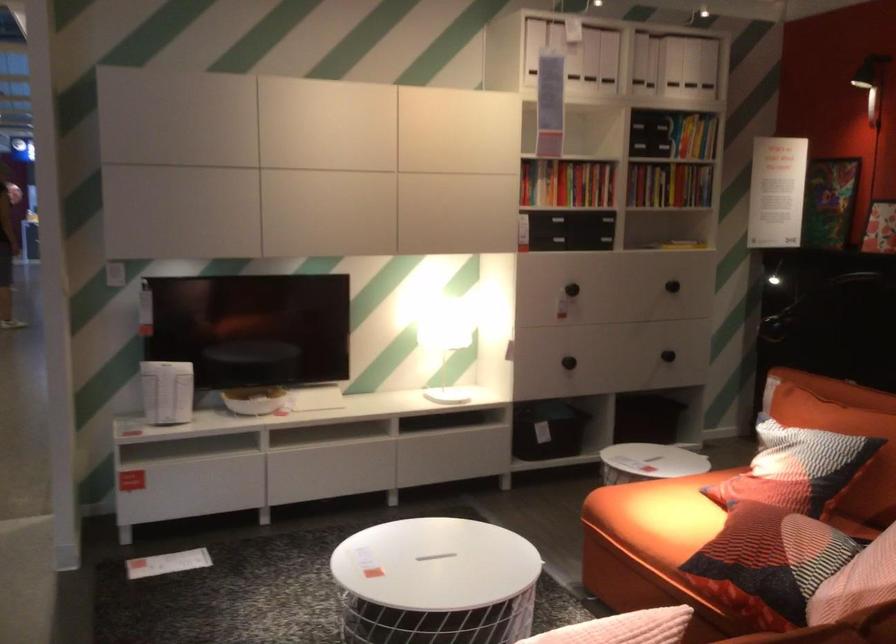
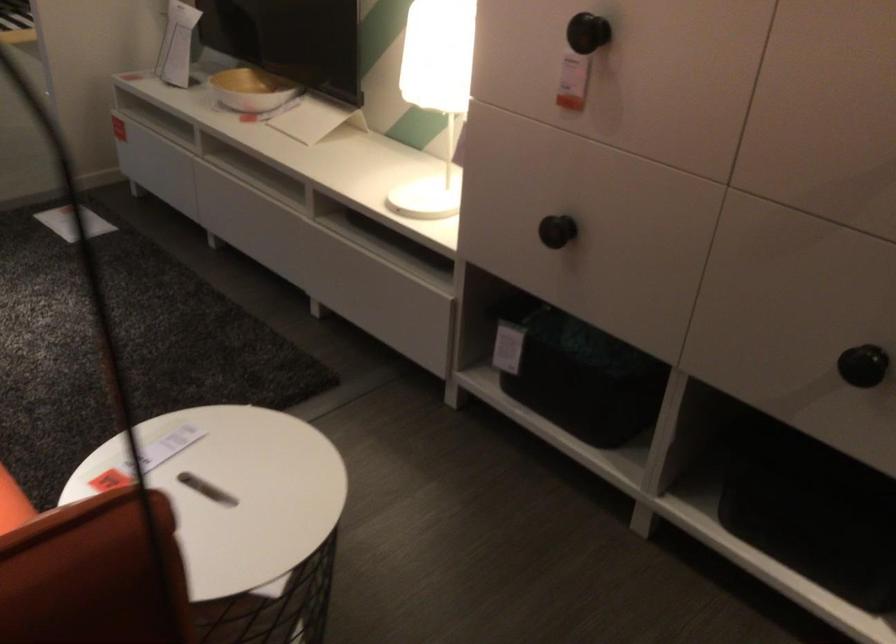
The point at (x=703, y=330) is marked in the first image. Where is the corresponding point in the second image?

(863, 365)